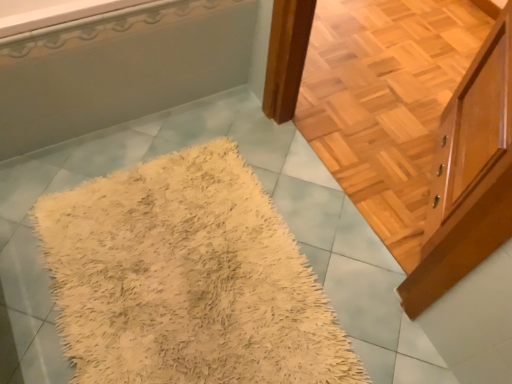
Question: Is light brown wood cabinet at upper right outside of beige shaggy rug at center?

Choices:
 (A) no
 (B) yes

Answer: (B)

Question: Does light brown wood cabinet at upper right have a smaller size compared to beige shaggy rug at center?

Choices:
 (A) yes
 (B) no

Answer: (B)

Question: Is light brown wood cabinet at upper right bigger than beige shaggy rug at center?

Choices:
 (A) yes
 (B) no

Answer: (A)

Question: Is light brown wood cabinet at upper right positioned behind beige shaggy rug at center?

Choices:
 (A) yes
 (B) no

Answer: (B)

Question: Considering the relative sizes of light brown wood cabinet at upper right and beige shaggy rug at center in the image provided, is light brown wood cabinet at upper right taller than beige shaggy rug at center?

Choices:
 (A) yes
 (B) no

Answer: (A)

Question: Does point (20, 89) appear closer or farther from the camera than point (499, 200)?

Choices:
 (A) farther
 (B) closer

Answer: (A)

Question: From a real-world perspective, is white glossy bathtub at upper left positioned above or below light brown wood cabinet at upper right?

Choices:
 (A) above
 (B) below

Answer: (B)

Question: In terms of width, does white glossy bathtub at upper left look wider or thinner when compared to light brown wood cabinet at upper right?

Choices:
 (A) wide
 (B) thin

Answer: (A)

Question: Is white glossy bathtub at upper left taller or shorter than light brown wood cabinet at upper right?

Choices:
 (A) short
 (B) tall

Answer: (A)

Question: Considering the positions of beige shaggy rug at center and white glossy bathtub at upper left in the image, is beige shaggy rug at center bigger or smaller than white glossy bathtub at upper left?

Choices:
 (A) small
 (B) big

Answer: (A)

Question: In terms of width, does beige shaggy rug at center look wider or thinner when compared to white glossy bathtub at upper left?

Choices:
 (A) thin
 (B) wide

Answer: (B)

Question: Is point (202, 231) positioned closer to the camera than point (167, 26)?

Choices:
 (A) closer
 (B) farther

Answer: (B)

Question: Is beige shaggy rug at center inside the boundaries of white glossy bathtub at upper left, or outside?

Choices:
 (A) outside
 (B) inside

Answer: (A)

Question: From the image's perspective, is light brown wood cabinet at upper right above or below beige shaggy rug at center?

Choices:
 (A) below
 (B) above

Answer: (B)

Question: Relative to beige shaggy rug at center, is light brown wood cabinet at upper right in front or behind?

Choices:
 (A) behind
 (B) front

Answer: (B)